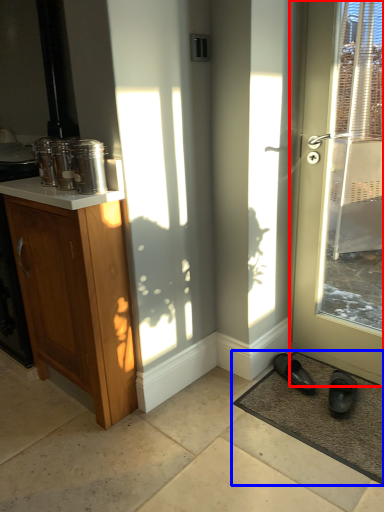
Question: Which of the following is the farthest to the observer, door (highlighted by a red box) or doormat (highlighted by a blue box)?

Choices:
 (A) door
 (B) doormat

Answer: (B)